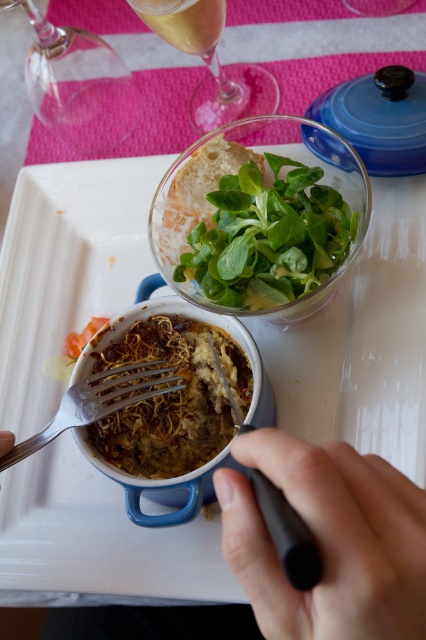
Question: Can you confirm if black plastic fork at lower center is positioned above translucent glass beverage at upper center?

Choices:
 (A) yes
 (B) no

Answer: (B)

Question: Based on their relative distances, which object is nearer to the clear glass wine glass at upper center?

Choices:
 (A) blue ceramic bowl at center
 (B) black plastic fork at lower center
 (C) transparent glass bowl at upper center

Answer: (C)

Question: Which object appears farthest from the camera in this image?

Choices:
 (A) black rubber pen at lower center
 (B) clear glass wine glass at upper center

Answer: (B)

Question: Which point is farther to the camera?

Choices:
 (A) shiny brown pasta at center
 (B) blue ceramic bowl at center

Answer: (A)

Question: Is blue ceramic bowl at center to the right of black rubber pen at lower center from the viewer's perspective?

Choices:
 (A) yes
 (B) no

Answer: (B)

Question: Is black rubber pen at lower center in front of silver metallic fork at lower left?

Choices:
 (A) yes
 (B) no

Answer: (A)